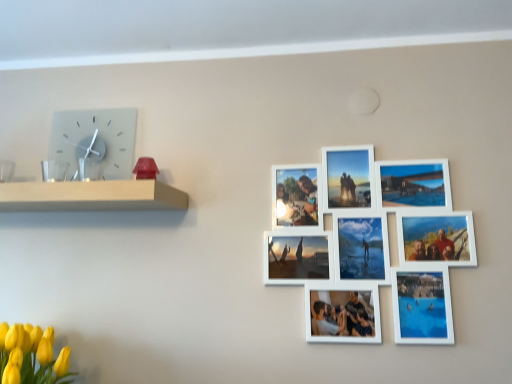
The height and width of the screenshot is (384, 512). Describe the element at coordinates (388, 281) in the screenshot. I see `white matte picture frame at upper right` at that location.

I want to click on matte glass clock at upper left, so click(96, 140).

How many degrees apart are the facing directions of white matte picture frame at upper right and matte glass clock at upper left?

white matte picture frame at upper right and matte glass clock at upper left are facing 0.945 degrees away from each other.

Who is bigger, white matte picture frame at upper right or matte glass clock at upper left?

white matte picture frame at upper right is bigger.

Do you think white matte picture frame at upper right is within matte glass clock at upper left, or outside of it?

white matte picture frame at upper right is not enclosed by matte glass clock at upper left.

From a real-world perspective, who is located higher, white matte picture frame at upper right or matte glass clock at upper left?

matte glass clock at upper left.

Which object is closer to the camera taking this photo, yellow matte tulips at lower left or white wooden shelf at left?

Positioned in front is yellow matte tulips at lower left.

From the image's perspective, does yellow matte tulips at lower left appear higher than white wooden shelf at left?

No.

Is yellow matte tulips at lower left turned away from white wooden shelf at left?

No, yellow matte tulips at lower left is not facing the opposite direction of white wooden shelf at left.

Which of these two, yellow matte tulips at lower left or white wooden shelf at left, is wider?

Wider between the two is yellow matte tulips at lower left.

From a real-world perspective, is white matte picture frame at upper right below yellow matte tulips at lower left?

Actually, white matte picture frame at upper right is physically above yellow matte tulips at lower left in the real world.

Does white matte picture frame at upper right turn towards yellow matte tulips at lower left?

No, white matte picture frame at upper right does not turn towards yellow matte tulips at lower left.

From the image's perspective, is white matte picture frame at upper right positioned above or below yellow matte tulips at lower left?

From the image's perspective, white matte picture frame at upper right appears above yellow matte tulips at lower left.

Between yellow matte tulips at lower left and white matte picture frame at upper right, which one has larger size?

yellow matte tulips at lower left is bigger.

Is yellow matte tulips at lower left further to camera compared to white matte picture frame at upper right?

No.

What's the angular difference between yellow matte tulips at lower left and white matte picture frame at upper right's facing directions?

The angular difference between yellow matte tulips at lower left and white matte picture frame at upper right is 1.33 degrees.

Could white matte picture frame at upper right be considered to be inside yellow matte tulips at lower left?

No, white matte picture frame at upper right is located outside of yellow matte tulips at lower left.

Would you say white wooden shelf at left is a long distance from yellow matte tulips at lower left?

That's not correct — white wooden shelf at left is a little close to yellow matte tulips at lower left.

Is white wooden shelf at left situated inside yellow matte tulips at lower left or outside?

white wooden shelf at left is located beyond the bounds of yellow matte tulips at lower left.

Find the location of `flower located in front of the white wooden shelf at left`. flower located in front of the white wooden shelf at left is located at coordinates (31, 356).

Is white wooden shelf at left positioned behind white matte picture frame at upper right?

No, it is not.

Which point is more forward, (93, 199) or (457, 242)?

The point (93, 199) is closer.

Considering the sizes of objects white wooden shelf at left and matte glass clock at upper left in the image provided, who is thinner, white wooden shelf at left or matte glass clock at upper left?

matte glass clock at upper left is thinner.

From a real-world perspective, is white wooden shelf at left on top of matte glass clock at upper left?

No, from a real-world perspective, white wooden shelf at left is not above matte glass clock at upper left.

Consider the image. Between white wooden shelf at left and matte glass clock at upper left, which one appears on the right side from the viewer's perspective?

From the viewer's perspective, white wooden shelf at left appears more on the right side.

Is white wooden shelf at left positioned beyond the bounds of matte glass clock at upper left?

Yes, white wooden shelf at left is not within matte glass clock at upper left.

Where is `picture frame beneath the matte glass clock at upper left (from a real-world perspective)`? picture frame beneath the matte glass clock at upper left (from a real-world perspective) is located at coordinates (388, 281).

The image size is (512, 384). I want to click on shelf above the yellow matte tulips at lower left (from the image's perspective), so click(91, 196).

Based on their spatial positions, is matte glass clock at upper left or yellow matte tulips at lower left closer to white matte picture frame at upper right?

Among the two, matte glass clock at upper left is located nearer to white matte picture frame at upper right.

Which object lies nearer to the anchor point matte glass clock at upper left, white wooden shelf at left or yellow matte tulips at lower left?

Answer: Based on the image, white wooden shelf at left appears to be nearer to matte glass clock at upper left.

Based on their spatial positions, is matte glass clock at upper left or white wooden shelf at left closer to white matte picture frame at upper right?

white wooden shelf at left is closer to white matte picture frame at upper right.

From the image, which object appears to be nearer to white wooden shelf at left, matte glass clock at upper left or yellow matte tulips at lower left?

matte glass clock at upper left lies closer to white wooden shelf at left than the other object.

Based on their spatial positions, is yellow matte tulips at lower left or matte glass clock at upper left closer to white matte picture frame at upper right?

matte glass clock at upper left is closer to white matte picture frame at upper right.

From the image, which object appears to be farther from yellow matte tulips at lower left, white matte picture frame at upper right or matte glass clock at upper left?

Based on the image, white matte picture frame at upper right appears to be further to yellow matte tulips at lower left.

Estimate the real-world distances between objects in this image. Which object is closer to white matte picture frame at upper right, white wooden shelf at left or yellow matte tulips at lower left?

white wooden shelf at left.

Based on the photo, when comparing their distances from white wooden shelf at left, does white matte picture frame at upper right or matte glass clock at upper left seem further?

white matte picture frame at upper right lies further to white wooden shelf at left than the other object.

I want to click on shelf situated between matte glass clock at upper left and white matte picture frame at upper right from left to right, so click(x=91, y=196).

Where is `wall clock located between yellow matte tulips at lower left and white matte picture frame at upper right in the left-right direction`? This screenshot has width=512, height=384. wall clock located between yellow matte tulips at lower left and white matte picture frame at upper right in the left-right direction is located at coordinates (96, 140).

I want to click on shelf located between yellow matte tulips at lower left and white matte picture frame at upper right in the left-right direction, so tap(91, 196).

Where is `shelf between matte glass clock at upper left and yellow matte tulips at lower left from top to bottom`? The image size is (512, 384). shelf between matte glass clock at upper left and yellow matte tulips at lower left from top to bottom is located at coordinates (91, 196).